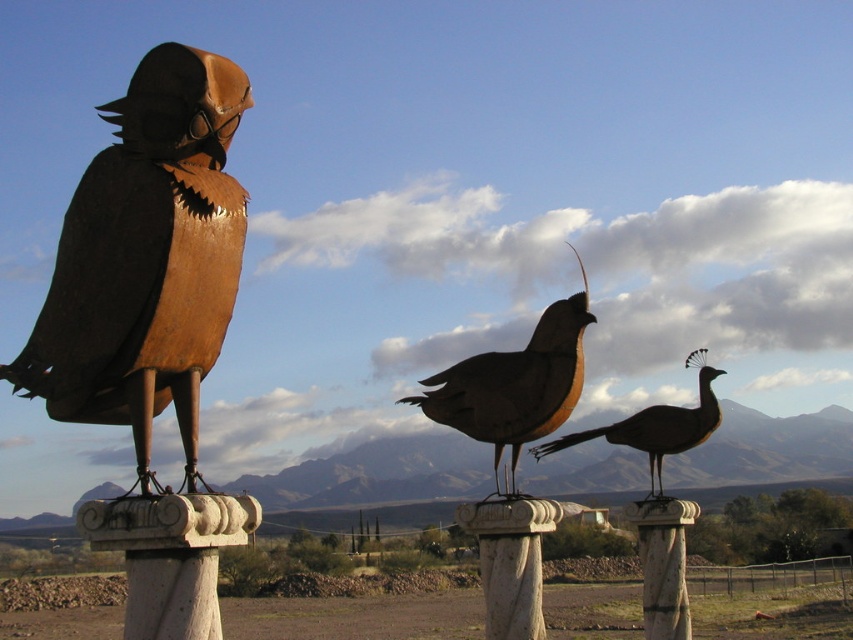
Between brown matte bird at center and shiny bronze peacock at center, which one appears on the left side from the viewer's perspective?

Positioned to the left is brown matte bird at center.

Who is taller, brown matte bird at center or shiny bronze peacock at center?

Standing taller between the two is brown matte bird at center.

The width and height of the screenshot is (853, 640). I want to click on brown matte bird at center, so click(515, 385).

Locate an element on the screen. Image resolution: width=853 pixels, height=640 pixels. brown matte bird at center is located at coordinates (515, 385).

This screenshot has width=853, height=640. Describe the element at coordinates (146, 259) in the screenshot. I see `rusty metal bird at left` at that location.

Is rusty metal bird at left to the left of white marble pillar at center from the viewer's perspective?

Indeed, rusty metal bird at left is positioned on the left side of white marble pillar at center.

Where is `rusty metal bird at left`? This screenshot has height=640, width=853. rusty metal bird at left is located at coordinates (146, 259).

Can you confirm if rusty metal bird at left is taller than brown matte bird at center?

Correct, rusty metal bird at left is much taller as brown matte bird at center.

Image resolution: width=853 pixels, height=640 pixels. Identify the location of rusty metal bird at left. (146, 259).